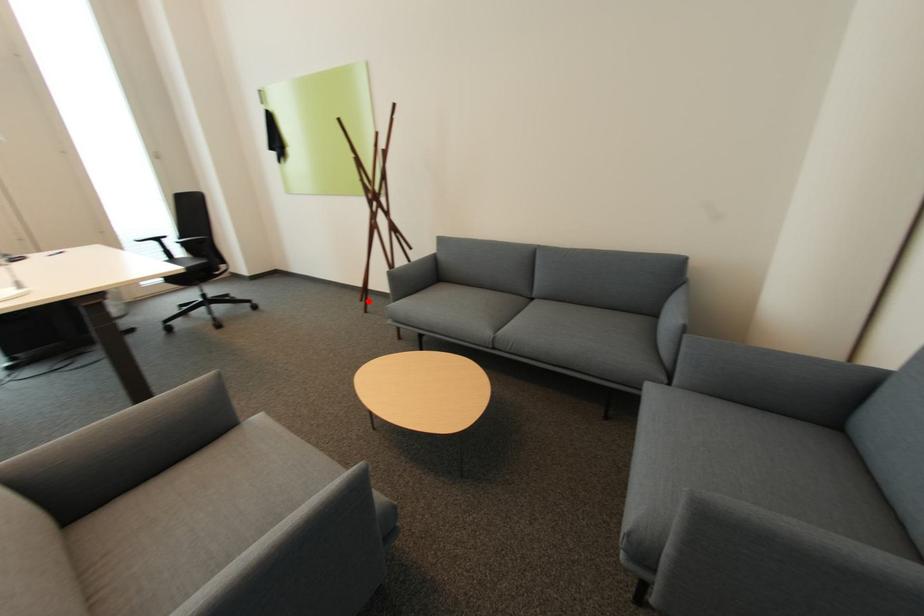
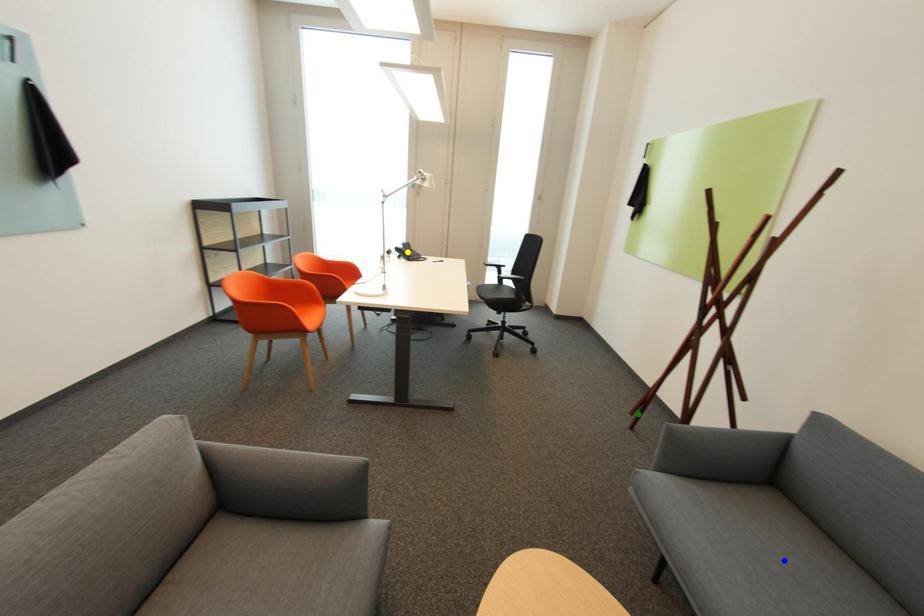
Question: I am providing you with two images of the same scene from different viewpoints. A red point is marked on the first image. You are given multiple points on the second image. Can you choose the point in image 2 that corresponds to the point in image 1?

Choices:
 (A) green point
 (B) blue point
 (C) yellow point

Answer: (A)